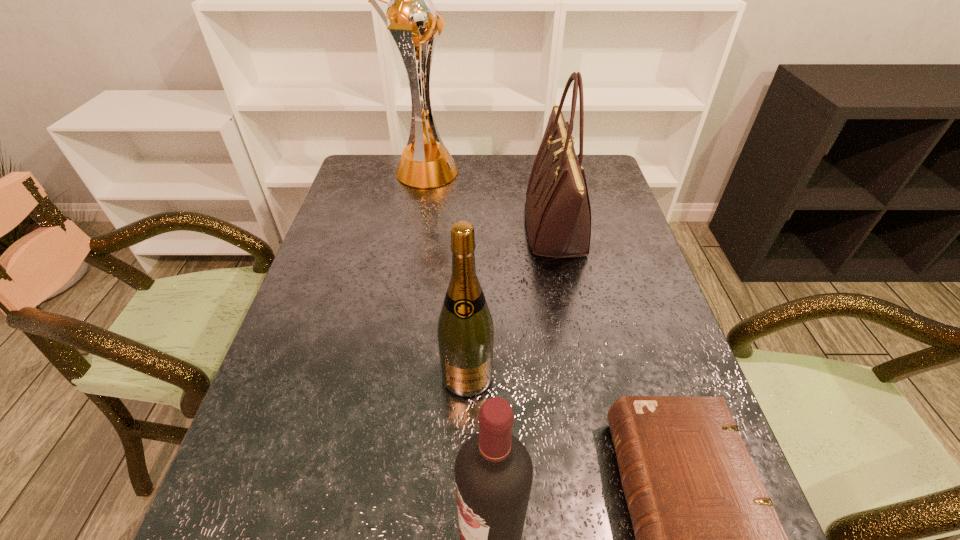
Where is `object present at the left edge`? This screenshot has width=960, height=540. object present at the left edge is located at coordinates (410, 15).

I want to click on object that is at the right edge, so click(558, 215).

Where is `object that is at the far left corner`? The height and width of the screenshot is (540, 960). object that is at the far left corner is located at coordinates (410, 15).

At what (x,y) coordinates should I click in order to perform the action: click on object that is at the far right corner. Please return your answer as a coordinate pair (x, y). Looking at the image, I should click on (558, 215).

The image size is (960, 540). What are the coordinates of `vacant space at the far edge of the desktop` in the screenshot? It's located at (432, 190).

The width and height of the screenshot is (960, 540). I want to click on free location at the left edge of the desktop, so click(x=330, y=294).

The image size is (960, 540). In the image, there is a desktop. Find the location of `vacant region at the right edge`. vacant region at the right edge is located at coordinates (663, 382).

In the image, there is a desktop. In order to click on vacant space at the far left corner in this screenshot , I will do `click(390, 180)`.

Locate an element on the screen. free spot between the tallest object and the handbag is located at coordinates (491, 200).

The width and height of the screenshot is (960, 540). Find the location of `free area in between the tallest object and the handbag`. free area in between the tallest object and the handbag is located at coordinates (491, 200).